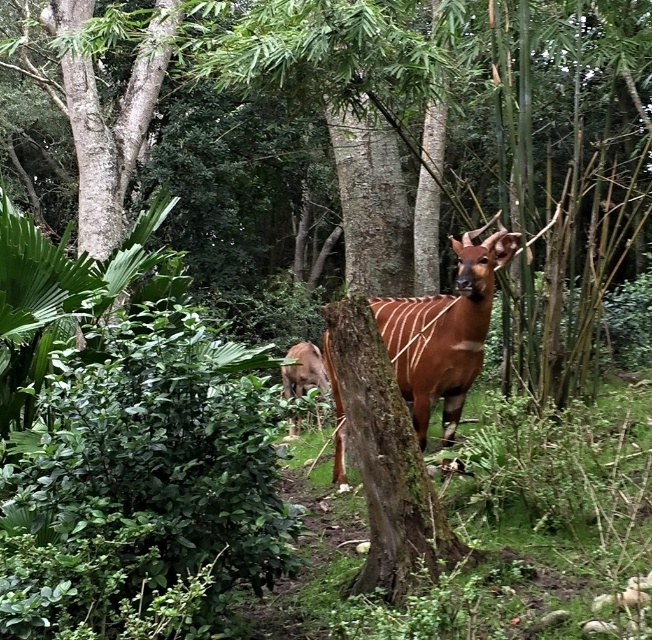
You are a wildlife photographer trying to capture a photo of both the brown glossy deer at center and the brown velvet antelope at center. Since you want to ensure both animals are in focus, you need to know which one is taller. Can you determine which animal is taller?

The brown glossy deer at center is taller than the brown velvet antelope at center, so you should adjust your camera settings to accommodate the height difference for better focus.

Consider the image. You are a photographer trying to capture both the green mossy bark tree trunk at center and the brown glossy deer at center in a single frame. Given their widths, which object would you need to position closer to the camera to ensure both fit within the frame?

The green mossy bark tree trunk at center has a lesser width compared to the brown glossy deer at center. To ensure both fit within the frame, you should position the narrower green mossy bark tree trunk at center closer to the camera and the wider brown glossy deer at center further back, as this arrangement would balance their apparent sizes in the photograph.

You are a hiker who wants to take a photo of the brown glossy deer at center without the green mossy bark tree trunk at center blocking the view. Is it possible to move forward or backward to achieve this?

The green mossy bark tree trunk at center is in front of the brown glossy deer at center, so moving backward might allow you to see the deer without the tree trunk blocking the view.